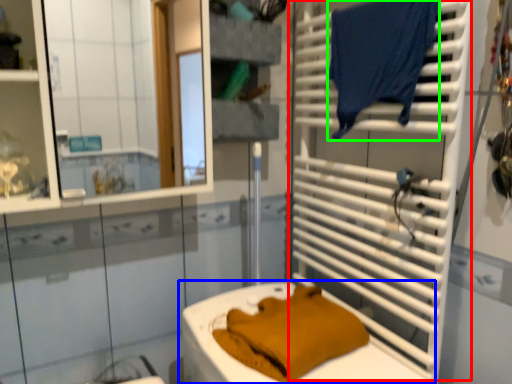
Question: Which object is the closest to the shutter (highlighted by a red box)? Choose among these: toilet (highlighted by a blue box) or laundry (highlighted by a green box).

Choices:
 (A) toilet
 (B) laundry

Answer: (B)